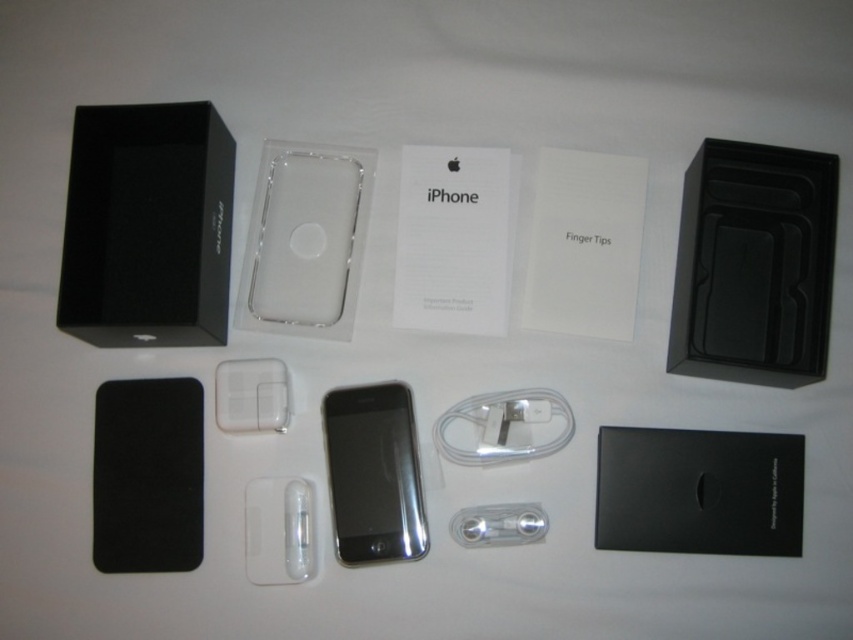
Question: Considering the real-world distances, which object is farthest from the clear plastic ipod at center?

Choices:
 (A) white glossy ipod at center
 (B) black glossy speaker at upper left

Answer: (B)

Question: Which is farther from the white glossy ipod at center?

Choices:
 (A) clear plastic ipod at center
 (B) black glossy speaker at upper left

Answer: (B)

Question: Does black matte speaker at upper right appear on the right side of sleek black phone at center?

Choices:
 (A) yes
 (B) no

Answer: (A)

Question: Considering the real-world distances, which object is farthest from the clear plastic ipod at center?

Choices:
 (A) sleek black phone at center
 (B) white glossy ipod at center

Answer: (B)

Question: Does black matte speaker at upper right have a larger size compared to white glossy cable at center?

Choices:
 (A) no
 (B) yes

Answer: (B)

Question: Does black matte speaker at upper right appear over sleek black phone at center?

Choices:
 (A) yes
 (B) no

Answer: (A)